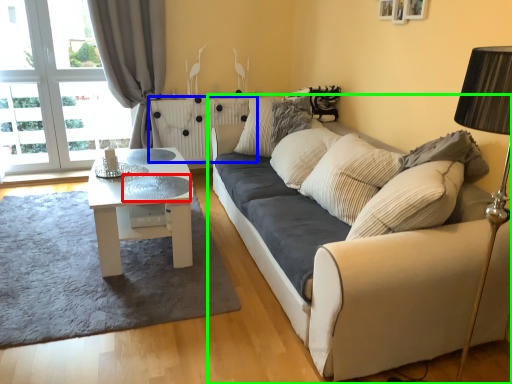
Question: Considering the real-world distances, which object is closest to glass table (highlighted by a red box)? radiator (highlighted by a blue box) or studio couch (highlighted by a green box).

Choices:
 (A) radiator
 (B) studio couch

Answer: (B)